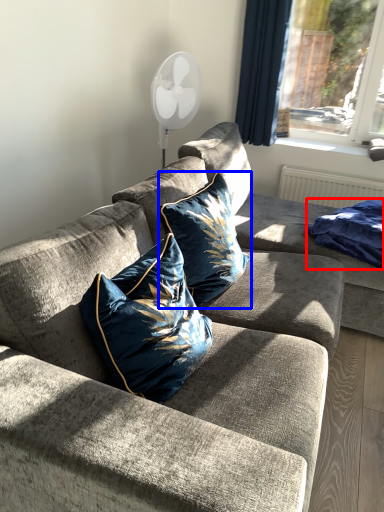
Question: Which of the following is the closest to the observer, material (highlighted by a red box) or pillow (highlighted by a blue box)?

Choices:
 (A) material
 (B) pillow

Answer: (B)